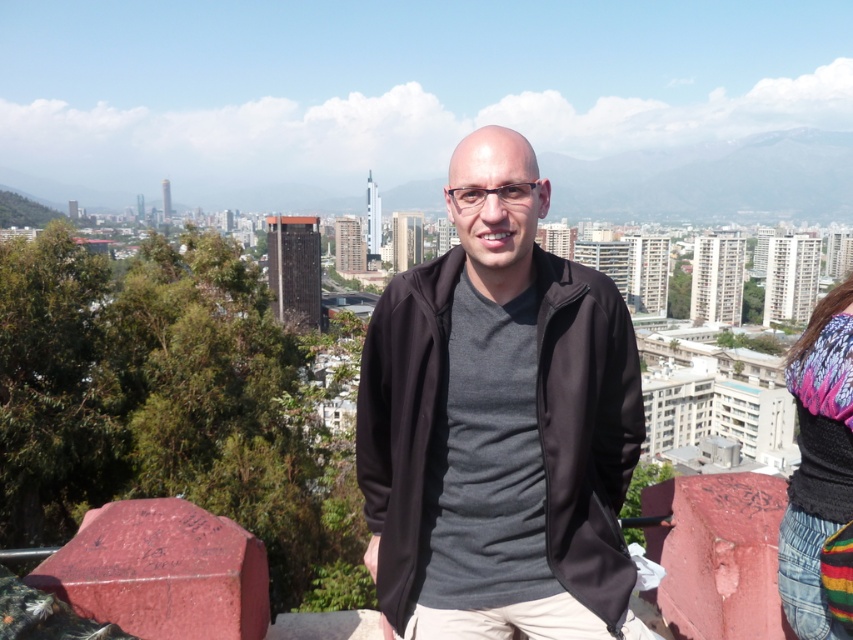
Question: Is black matte jacket at center below knitted multicolor sweater at right?

Choices:
 (A) yes
 (B) no

Answer: (B)

Question: Which point is closer to the camera?

Choices:
 (A) knitted multicolor sweater at right
 (B) black matte jacket at center

Answer: (A)

Question: Can you confirm if black matte jacket at center is thinner than knitted multicolor sweater at right?

Choices:
 (A) yes
 (B) no

Answer: (B)

Question: Among these points, which one is nearest to the camera?

Choices:
 (A) (799, 572)
 (B) (372, 561)

Answer: (A)

Question: Can you confirm if black matte jacket at center is wider than knitted multicolor sweater at right?

Choices:
 (A) no
 (B) yes

Answer: (B)

Question: Which of the following is the closest to the observer?

Choices:
 (A) (786, 387)
 (B) (463, 160)

Answer: (B)